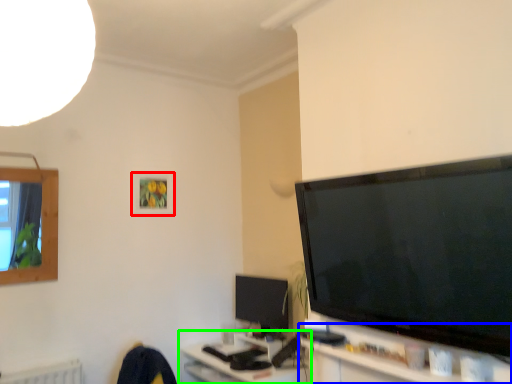
Question: Which object is the closest to the picture frame (highlighted by a red box)? Choose among these: tv cabinet (highlighted by a blue box) or computer (highlighted by a green box).

Choices:
 (A) tv cabinet
 (B) computer

Answer: (B)